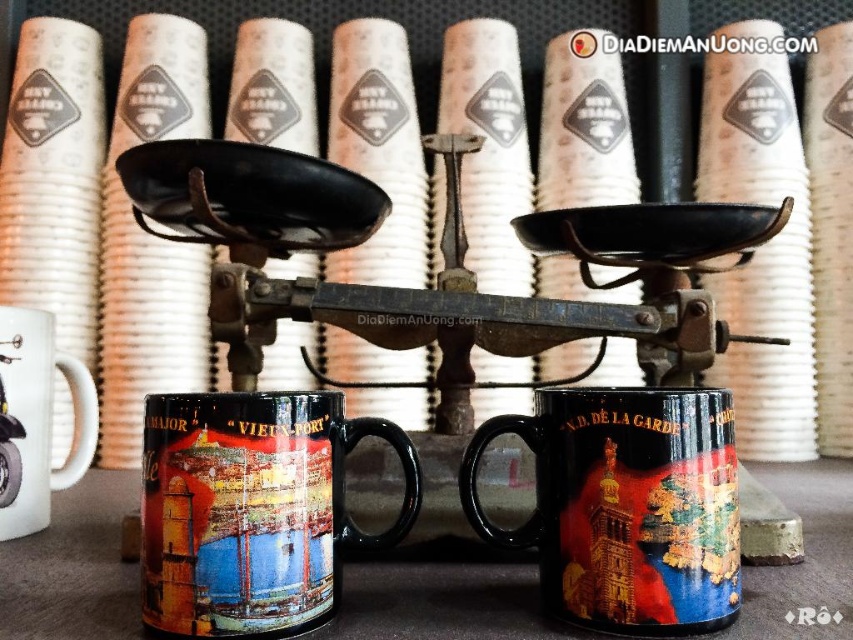
You are a barista working in the coffee shop and need to place a new black ceramic mug at center on the counter. The existing items are the mechanical scale with paper cups behind it and the two mugs in front. Where should you place the new mug so it doesn t interfere with the scale and the existing mugs?

The black ceramic mug at center is already positioned at point 0.735, so placing it there would not interfere with the existing items.

You are a barista who needs to place both the black metal scale at center and the glossy ceramic mug at center on a shelf that can only hold items up to 12 inches in height. Given their height relationship, which item should you place first to ensure they both fit?

The glossy ceramic mug at center is shorter than the black metal scale at center. Since the shelf can hold up to 12 inches, you should place the taller black metal scale at center first to ensure it fits, then the shorter glossy ceramic mug at center.